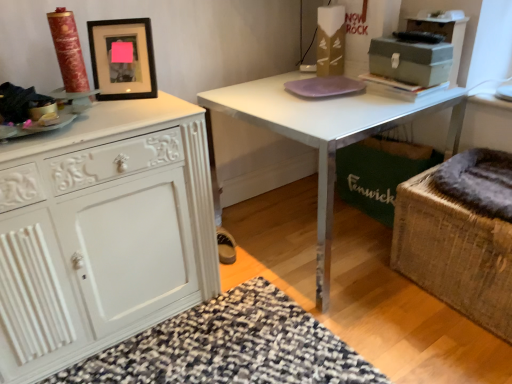
What are the coordinates of `vacant space situated above rattan wicker swivel chair at lower right, marked as the second swivel chair in a top-to-bottom arrangement (from a real-world perspective)` in the screenshot? It's located at (477, 186).